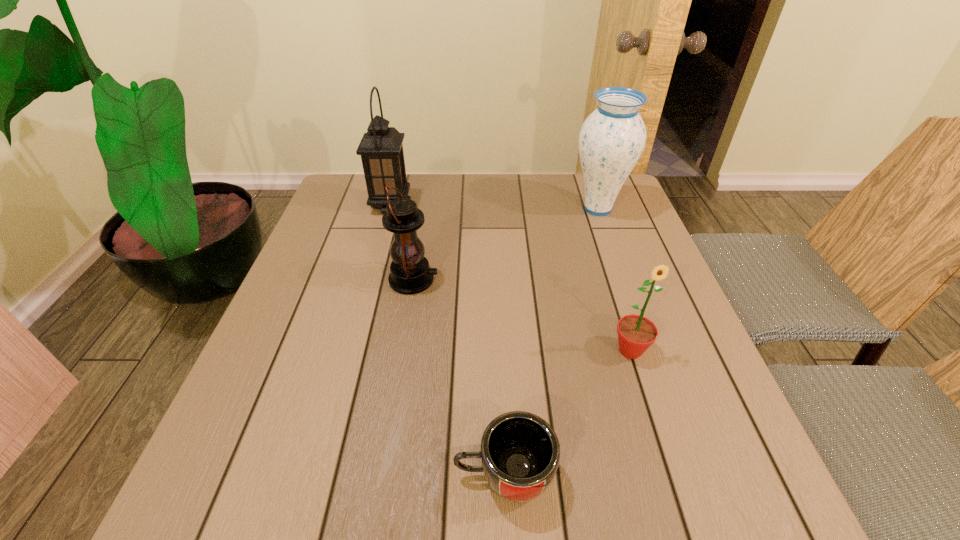
Where is `free spot located on the face of the fourth farthest object`? The image size is (960, 540). free spot located on the face of the fourth farthest object is located at coordinates (671, 478).

You are a GUI agent. You are given a task and a screenshot of the screen. Output one action in this format:
    pyautogui.click(x=<x>, y=<y>)
    Task: Click on the free space located 0.390m on the side of the nearest object with the handle
    The height and width of the screenshot is (540, 960).
    Given the screenshot: What is the action you would take?
    pyautogui.click(x=211, y=475)

Image resolution: width=960 pixels, height=540 pixels. I want to click on blank space located on the side of the nearest object with the handle, so click(x=404, y=475).

Locate an element on the screen. This screenshot has width=960, height=540. free space located 0.150m on the side of the nearest object with the handle is located at coordinates (361, 475).

I want to click on lantern that is at the far edge, so click(381, 149).

Identify the location of vase that is at the far edge. (611, 141).

Find the location of a particular element. The width and height of the screenshot is (960, 540). object that is at the near edge is located at coordinates (520, 452).

Locate an element on the screen. Image resolution: width=960 pixels, height=540 pixels. object present at the left edge is located at coordinates (381, 149).

Identify the location of vase that is at the right edge. (611, 141).

Find the location of a particular element. The width and height of the screenshot is (960, 540). sunflower present at the right edge is located at coordinates (636, 333).